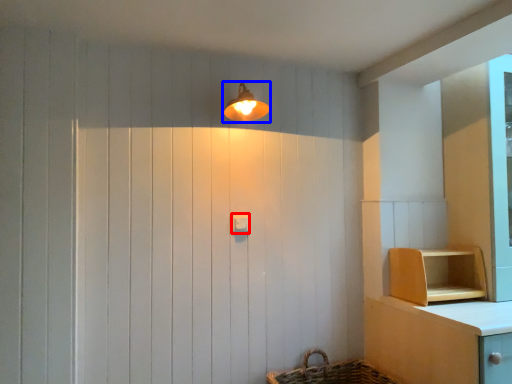
Question: Among these objects, which one is nearest to the camera, light switch (highlighted by a red box) or light fixture (highlighted by a blue box)?

Choices:
 (A) light switch
 (B) light fixture

Answer: (B)